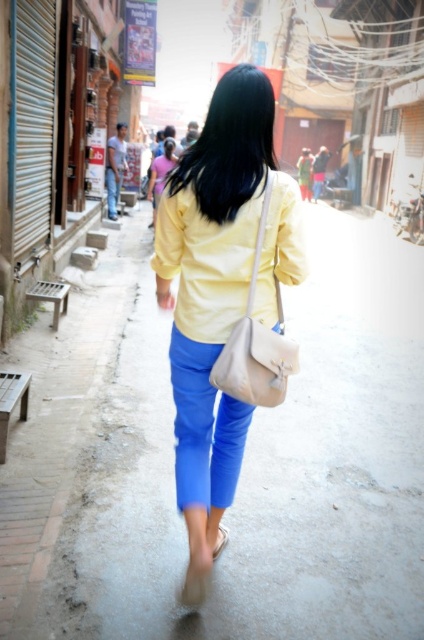
Is dull concrete pavement at center above beige leather shoulder bag at center?

No.

Based on the photo, does dull concrete pavement at center have a greater height compared to beige leather shoulder bag at center?

Yes, dull concrete pavement at center is taller than beige leather shoulder bag at center.

The height and width of the screenshot is (640, 424). Identify the location of dull concrete pavement at center. (265, 474).

Which of these two, matte yellow shirt at center or black silky hair at upper center, stands taller?

Standing taller between the two is matte yellow shirt at center.

Is matte yellow shirt at center positioned behind black silky hair at upper center?

That is False.

Locate an element on the screen. matte yellow shirt at center is located at coordinates (212, 298).

The height and width of the screenshot is (640, 424). I want to click on matte yellow shirt at center, so click(212, 298).

Between point (293, 218) and point (170, 156), which one is positioned in front?

Positioned in front is point (293, 218).

Based on the photo, can you confirm if yellow matte jacket at center is shorter than black silky hair at upper center?

No.

Is point (240, 208) positioned in front of point (166, 140)?

Yes, point (240, 208) is closer to viewer.

At what (x,y) coordinates should I click in order to perform the action: click on yellow matte jacket at center. Please return your answer as a coordinate pair (x, y). This screenshot has width=424, height=640. Looking at the image, I should click on (206, 262).